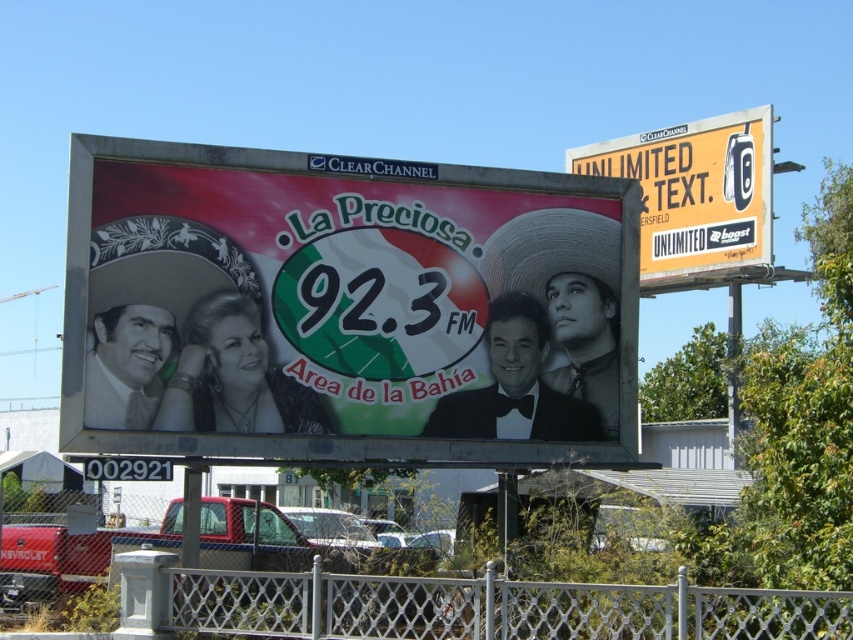
You are a delivery person who needs to place a new yellow paper sign at upper right exactly 5 meters away from the matte plastic billboard at center. Based on the current positioning, can you place the sign where you want?

The matte plastic billboard at center is currently 4.93 meters from the yellow paper sign at upper right, which is 0.07 meters less than the required 5 meters. Therefore, you need to move the yellow paper sign at upper right slightly further away from the matte plastic billboard at center to achieve the desired distance.

You are standing in front of the two billboards and want to touch the closest point between point (257, 228) and point (755, 260). Which point should you aim for?

Point (257, 228) is closer to the camera than point (755, 260), so you should aim for point (257, 228).

You are a delivery person who needs to hang a new advertisement that is 2 meters wide. You see the matte plastic billboard at center and the yellow paper sign at upper right. Which billboard can accommodate the new advertisement without needing to resize it?

The matte plastic billboard at center has a larger width than the yellow paper sign at upper right, so it can accommodate the new advertisement without resizing.